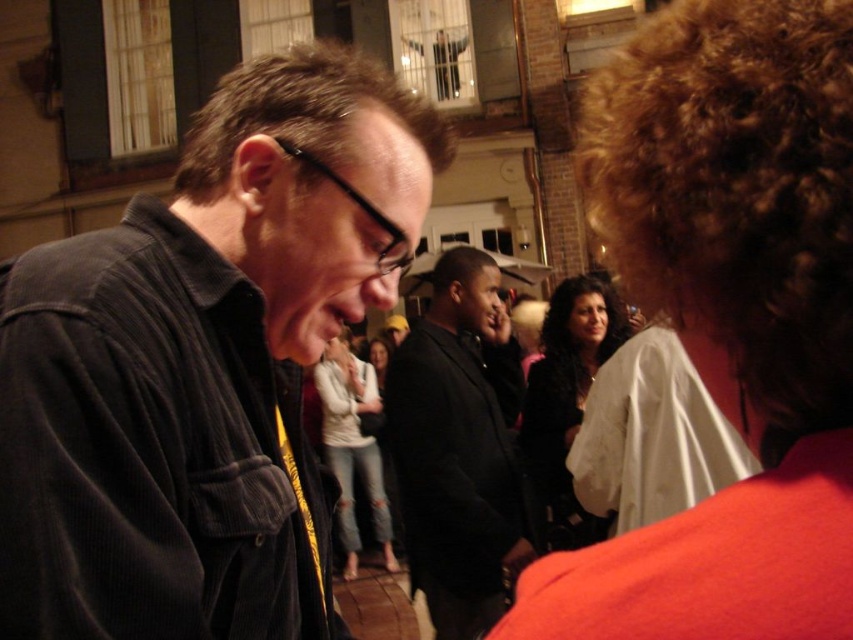
Between point (474, 296) and point (343, 456), which one is positioned behind?

The point (343, 456) is more distant.

Between point (468, 593) and point (332, 387), which one is positioned behind?

Positioned behind is point (332, 387).

Find the location of a particular element. This screenshot has height=640, width=853. black matte suit at center is located at coordinates (457, 445).

Who is positioned more to the right, dark corduroy jacket at center or matte white shirt at center?

From the viewer's perspective, dark corduroy jacket at center appears more on the right side.

Which is more to the left, dark corduroy jacket at center or matte white shirt at center?

From the viewer's perspective, matte white shirt at center appears more on the left side.

At what (x,y) coordinates should I click in order to perform the action: click on dark corduroy jacket at center. Please return your answer as a coordinate pair (x, y). The height and width of the screenshot is (640, 853). Looking at the image, I should click on (202, 364).

Where is `dark corduroy jacket at center`? dark corduroy jacket at center is located at coordinates (202, 364).

Does point (140, 339) lie in front of point (347, 552)?

Yes, it is in front of point (347, 552).

Does dark corduroy jacket at center have a lesser width compared to ripped denim jeans at center?

Yes, dark corduroy jacket at center is thinner than ripped denim jeans at center.

The image size is (853, 640). In order to click on dark corduroy jacket at center in this screenshot , I will do 202,364.